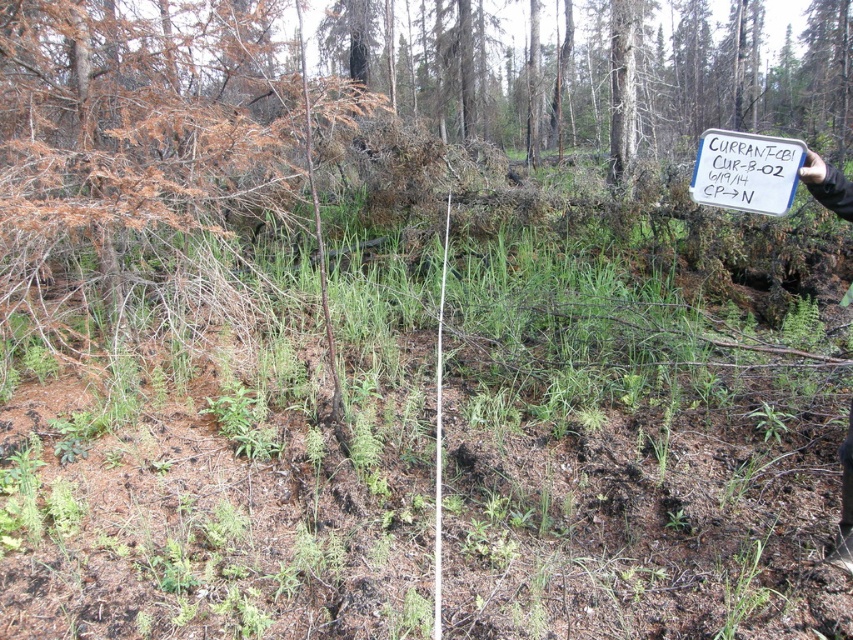
Can you confirm if white paper sign at upper right is thinner than white plastic sign at upper right?

Yes, white paper sign at upper right is thinner than white plastic sign at upper right.

Does white paper sign at upper right appear over white plastic sign at upper right?

Correct, white paper sign at upper right is located above white plastic sign at upper right.

Does point (787, 161) come farther from viewer compared to point (850, 211)?

Yes, it is.

Where is `white paper sign at upper right`? This screenshot has width=853, height=640. white paper sign at upper right is located at coordinates (746, 170).